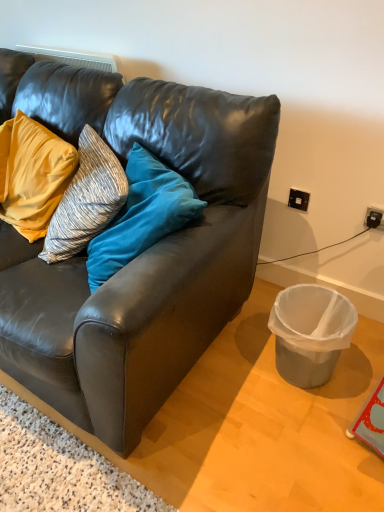
Where is `free space in front of metallic gray trash can at lower right`? This screenshot has width=384, height=512. free space in front of metallic gray trash can at lower right is located at coordinates (310, 430).